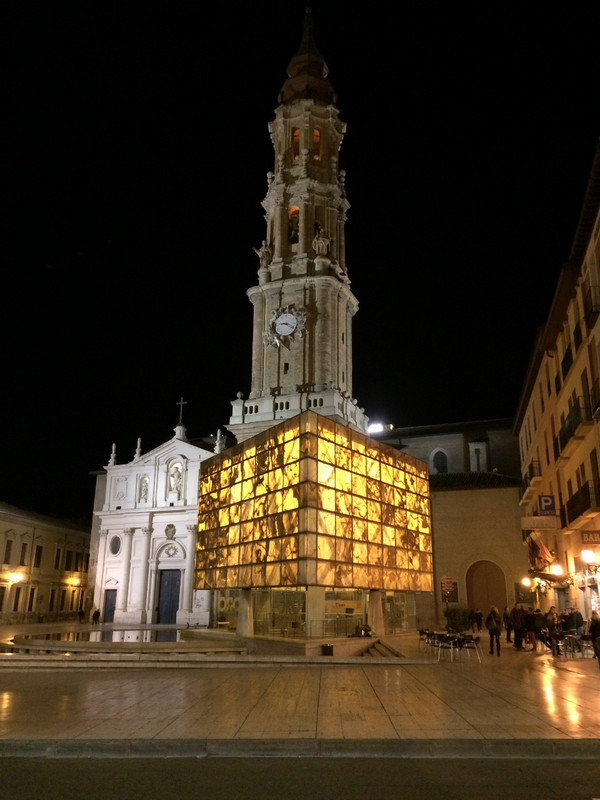
Locate an element on the screen. Image resolution: width=600 pixels, height=800 pixels. stairs is located at coordinates (375, 650).